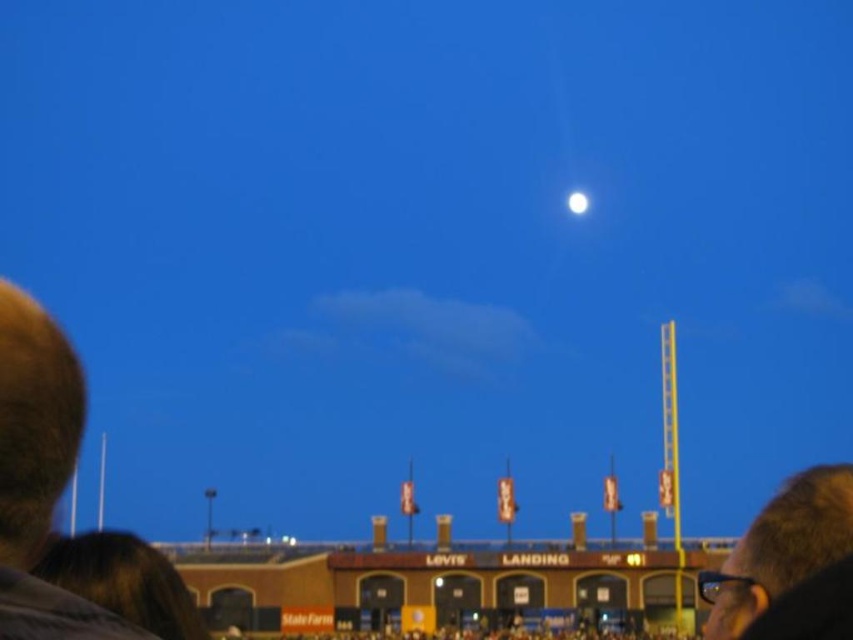
Question: Is brown hair at left above bright white sphere at upper center?

Choices:
 (A) no
 (B) yes

Answer: (A)

Question: Can you confirm if brown hair at left is bigger than bright white sphere at upper center?

Choices:
 (A) no
 (B) yes

Answer: (B)

Question: Does brown hair at left have a greater width compared to bright white sphere at upper center?

Choices:
 (A) no
 (B) yes

Answer: (B)

Question: Which of the following is the closest to the observer?

Choices:
 (A) (573, 202)
 (B) (4, 461)

Answer: (B)

Question: Estimate the real-world distances between objects in this image. Which object is farther from the dark brown hair at upper right?

Choices:
 (A) brown hair at left
 (B) bright white sphere at upper center

Answer: (A)

Question: Which of these objects is positioned closest to the bright white sphere at upper center?

Choices:
 (A) brown hair at left
 (B) dark brown hair at upper right

Answer: (B)